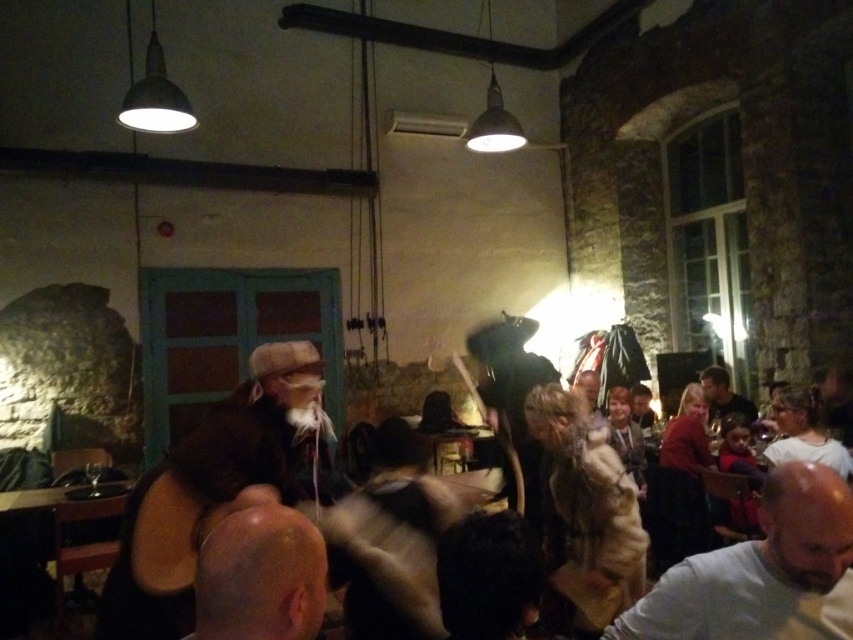
Does dark brown leather jacket at right appear on the right side of smooth brown leather jacket at center?

Indeed, dark brown leather jacket at right is positioned on the right side of smooth brown leather jacket at center.

Who is more distant from viewer, (711, 392) or (589, 396)?

Point (589, 396)

Does point (717, 401) come behind point (589, 401)?

No, (717, 401) is closer to viewer.

The height and width of the screenshot is (640, 853). Find the location of `dark brown leather jacket at right`. dark brown leather jacket at right is located at coordinates (723, 396).

Is brown leather jacket at center to the right of bald head at lower left from the viewer's perspective?

In fact, brown leather jacket at center is to the left of bald head at lower left.

Can you confirm if brown leather jacket at center is wider than bald head at lower left?

Yes, brown leather jacket at center is wider than bald head at lower left.

Is point (200, 472) positioned before point (294, 572)?

No, (200, 472) is behind (294, 572).

At what (x,y) coordinates should I click in order to perform the action: click on brown leather jacket at center. Please return your answer as a coordinate pair (x, y). Looking at the image, I should click on (219, 480).

Is gray matte shirt at lower right above dark brown leather jacket at right?

Correct, gray matte shirt at lower right is located above dark brown leather jacket at right.

Does gray matte shirt at lower right appear on the right side of dark brown leather jacket at right?

No, gray matte shirt at lower right is not to the right of dark brown leather jacket at right.

The height and width of the screenshot is (640, 853). What are the coordinates of `gray matte shirt at lower right` in the screenshot? It's located at (762, 572).